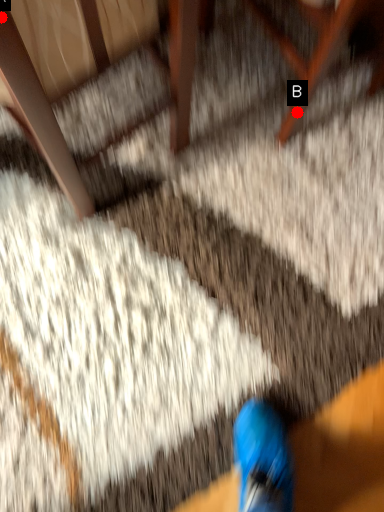
Question: Two points are circled on the image, labeled by A and B beside each circle. Which point is further to the camera?

Choices:
 (A) A is further
 (B) B is further

Answer: (B)